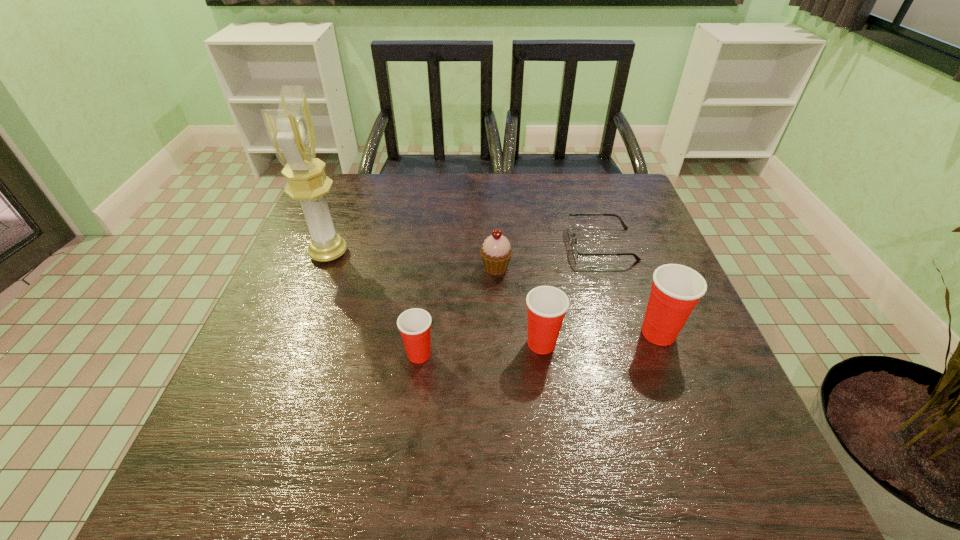
The height and width of the screenshot is (540, 960). I want to click on free space between the second Dixie cup from left to right and the shortest object, so click(571, 294).

What are the coordinates of `free space between the spectacles and the tallest Dixie cup` in the screenshot? It's located at (630, 288).

The width and height of the screenshot is (960, 540). Identify the location of unoccupied position between the fourth object from right to left and the second Dixie cup from right to left. (518, 306).

Where is `empty space between the fourth object from left to right and the rightmost Dixie cup`? The height and width of the screenshot is (540, 960). empty space between the fourth object from left to right and the rightmost Dixie cup is located at coordinates (600, 338).

The height and width of the screenshot is (540, 960). I want to click on object that stands as the second closest to the third object from left to right, so click(546, 305).

The height and width of the screenshot is (540, 960). What are the coordinates of `the second closest object to the award` in the screenshot? It's located at (496, 252).

Choose which Dixie cup is the third nearest neighbor to the shortest object. Please provide its 2D coordinates. Your answer should be formatted as a tuple, i.e. [(x, y)], where the tuple contains the x and y coordinates of a point satisfying the conditions above.

[(414, 325)]

Identify which Dixie cup is the closest to the third object from right to left. Please provide its 2D coordinates. Your answer should be formatted as a tuple, i.e. [(x, y)], where the tuple contains the x and y coordinates of a point satisfying the conditions above.

[(676, 289)]

Where is `vacant area that satisfies the following two spatial constraints: 1. on the front-facing side of the award; 2. on the right side of the tallest Dixie cup`? This screenshot has width=960, height=540. vacant area that satisfies the following two spatial constraints: 1. on the front-facing side of the award; 2. on the right side of the tallest Dixie cup is located at coordinates (298, 333).

I want to click on vacant area that satisfies the following two spatial constraints: 1. on the back side of the shortest Dixie cup; 2. on the front-facing side of the leftmost object, so click(432, 253).